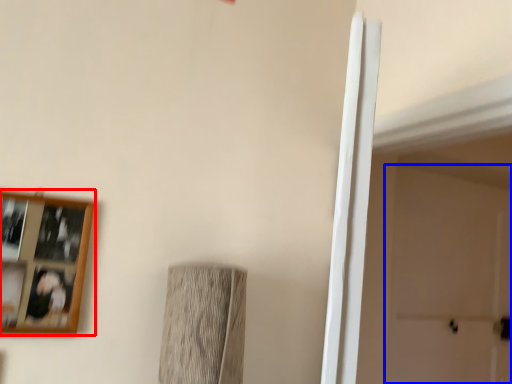
Question: Which of the following is the closest to the observer, picture frame (highlighted by a red box) or door (highlighted by a blue box)?

Choices:
 (A) picture frame
 (B) door

Answer: (A)